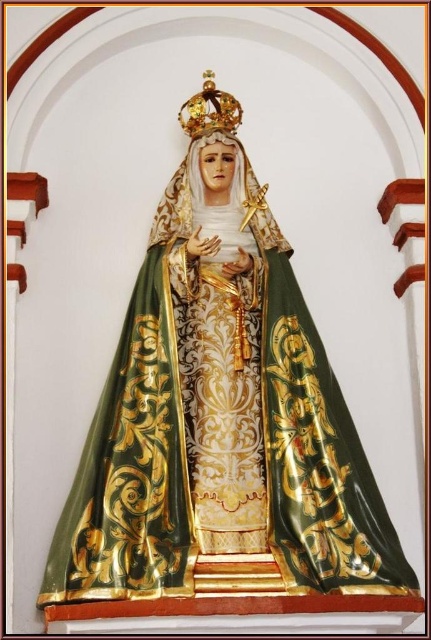
You are standing in front of the religious statue in the image. Where is the green satin cape at center located in relation to the statue?

The green satin cape at center is located at point (219, 417) in the image.

You are an interior designer planning to place a decorative item in the niche next to the green satin cape at center and the gold shiny crown at upper center. Which object should you choose to place closer to the center of the niche to maintain balance, considering their sizes?

The green satin cape at center has a larger width than the gold shiny crown at upper center, so placing the decorative item closer to the smaller gold shiny crown at upper center would help balance the composition.

Consider the image. You are an interior designer planning to install a new lighting fixture above the statue. The fixture must be tall enough to accommodate both the green satin cape at center and the gold shiny crown at upper center. Which object requires the lighting fixture to be taller to avoid casting a shadow on the statue?

The green satin cape at center requires the lighting fixture to be taller because it is taller than the gold shiny crown at upper center.